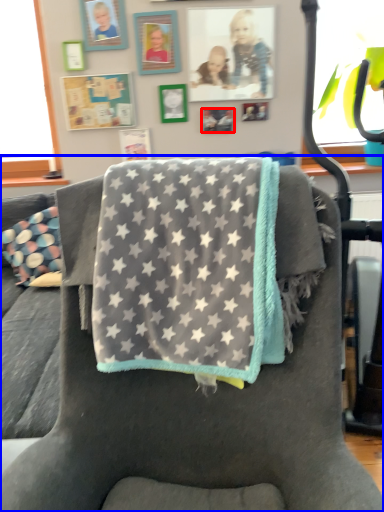
Question: Which object is further to the camera taking this photo, picture frame (highlighted by a red box) or chair (highlighted by a blue box)?

Choices:
 (A) picture frame
 (B) chair

Answer: (A)